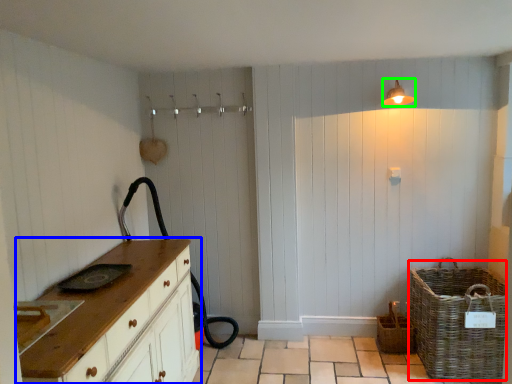
Question: Which object is the farthest from basket (highlighted by a red box)? Choose among these: chest of drawers (highlighted by a blue box) or light fixture (highlighted by a green box).

Choices:
 (A) chest of drawers
 (B) light fixture

Answer: (A)